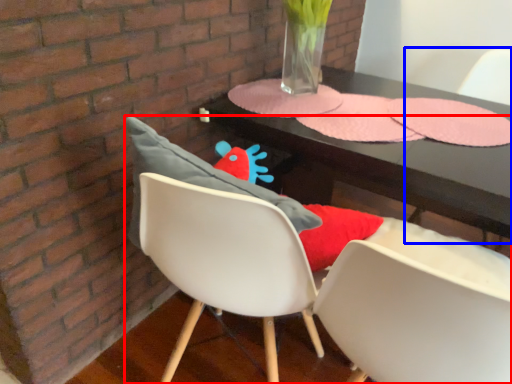
Question: Which object is closer to the camera taking this photo, chair (highlighted by a red box) or armchair (highlighted by a blue box)?

Choices:
 (A) chair
 (B) armchair

Answer: (A)